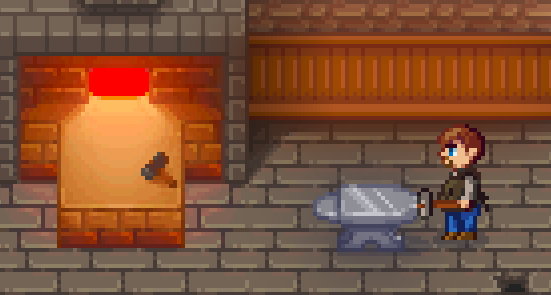
Find the location of a particular element. bottle is located at coordinates (75, 181).